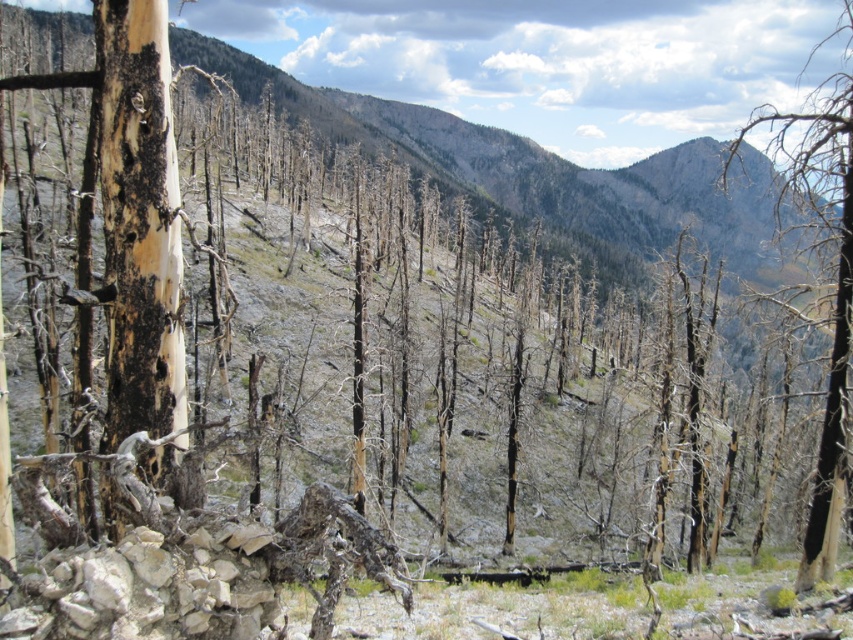
Which is above, charcoal textured tree trunk at left or charred wood tree at right?

Positioned higher is charred wood tree at right.

In the scene shown: Does charcoal textured tree trunk at left appear over charred wood tree at right?

No.

Find the location of a particular element. charcoal textured tree trunk at left is located at coordinates (138, 221).